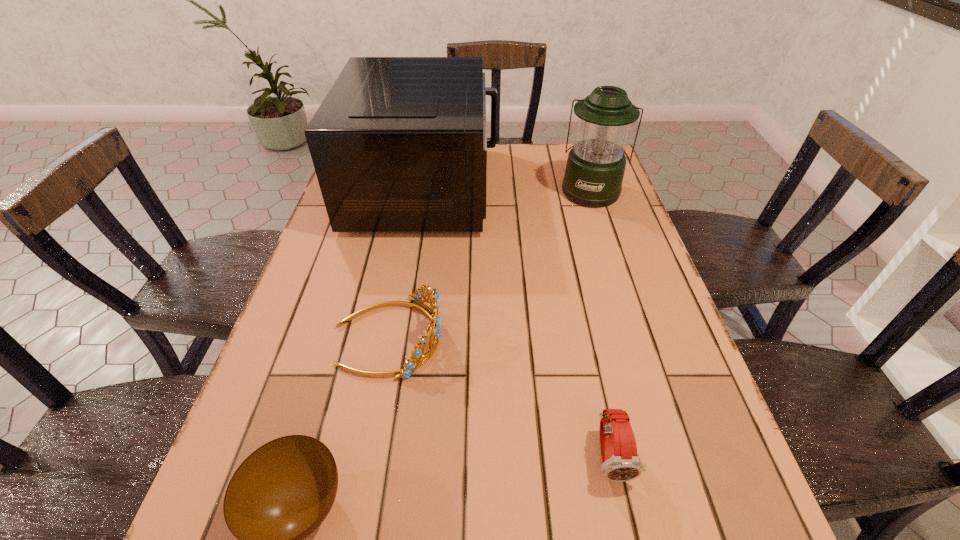
The width and height of the screenshot is (960, 540). Find the location of `microwave_oven that is at the left edge`. microwave_oven that is at the left edge is located at coordinates (399, 144).

The height and width of the screenshot is (540, 960). In order to click on tiara situated at the left edge in this screenshot , I will do `click(417, 353)`.

Find the location of a particular element. object at the right edge is located at coordinates (595, 167).

This screenshot has width=960, height=540. I want to click on object positioned at the far left corner, so click(x=399, y=144).

Where is `object that is at the far right corner`? The height and width of the screenshot is (540, 960). object that is at the far right corner is located at coordinates (595, 167).

Where is `free space at the far edge`? The image size is (960, 540). free space at the far edge is located at coordinates (528, 154).

The image size is (960, 540). Identify the location of blank space at the near edge of the desktop. (596, 526).

Identify the location of vacant position at the left edge of the desktop. (300, 291).

Locate an element on the screen. This screenshot has height=540, width=960. free space at the right edge of the desktop is located at coordinates (730, 472).

You are a GUI agent. You are given a task and a screenshot of the screen. Output one action in this format:
    pyautogui.click(x=<x>, y=<y>)
    Task: Click on the vacant space that's between the microwave_oven and the tiara
    The image size is (960, 540).
    Given the screenshot: What is the action you would take?
    pyautogui.click(x=407, y=262)